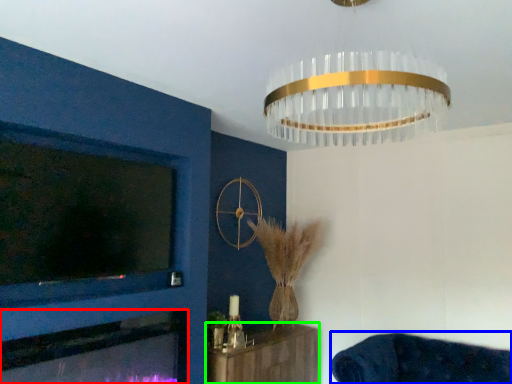
Question: Based on their relative distances, which object is nearer to fireplace (highlighted by a red box)? Choose from furniture (highlighted by a blue box) and furniture (highlighted by a green box).

Choices:
 (A) furniture
 (B) furniture

Answer: (B)